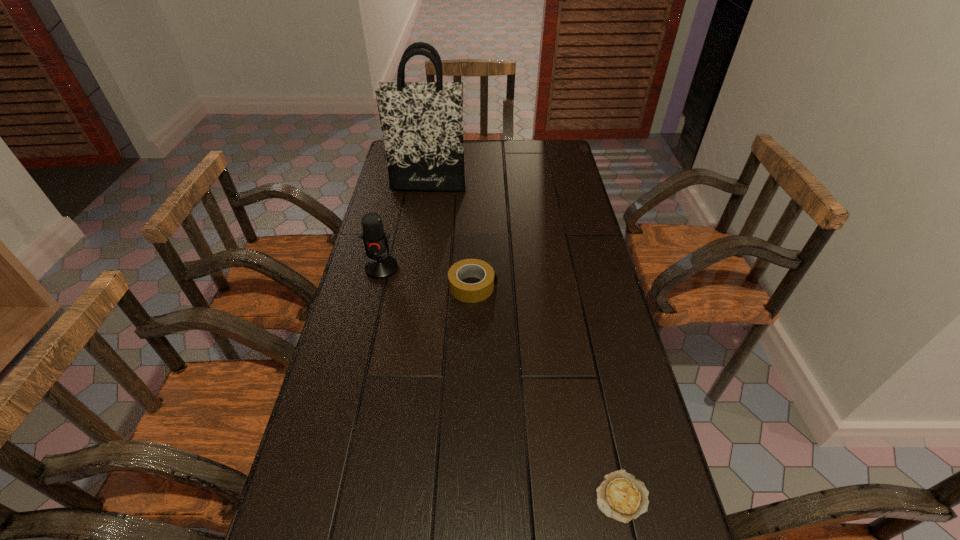
The width and height of the screenshot is (960, 540). Identify the location of free space between the third tallest object and the rightmost object. (547, 392).

The height and width of the screenshot is (540, 960). I want to click on free spot between the microphone and the farthest object, so click(405, 226).

What are the coordinates of `empty space between the second tallest object and the duct tape` in the screenshot? It's located at (427, 278).

This screenshot has width=960, height=540. In order to click on free space between the tallest object and the quiche in this screenshot , I will do pyautogui.click(x=525, y=340).

Locate an element on the screen. The height and width of the screenshot is (540, 960). empty space between the shortest object and the duct tape is located at coordinates (547, 392).

You are a GUI agent. You are given a task and a screenshot of the screen. Output one action in this format:
    pyautogui.click(x=<x>, y=<y>)
    Task: Click on the object that can be found as the third closest to the nearest object
    This screenshot has width=960, height=540.
    Given the screenshot: What is the action you would take?
    pyautogui.click(x=422, y=122)

The height and width of the screenshot is (540, 960). Identify the location of the second closest object to the second shortest object. (422, 122).

Image resolution: width=960 pixels, height=540 pixels. I want to click on vacant point that satisfies the following two spatial constraints: 1. on the side of the second tallest object with the red ring; 2. on the left side of the shortest object, so [328, 496].

In order to click on free location that satisfies the following two spatial constraints: 1. on the side of the shortest object with the red ring; 2. on the left side of the second tallest object in this screenshot , I will do `click(328, 496)`.

At what (x,y) coordinates should I click in order to perform the action: click on blank space that satisfies the following two spatial constraints: 1. on the back side of the quiche; 2. at the edge of the third tallest object. Please return your answer as a coordinate pair (x, y). Image resolution: width=960 pixels, height=540 pixels. Looking at the image, I should click on (576, 287).